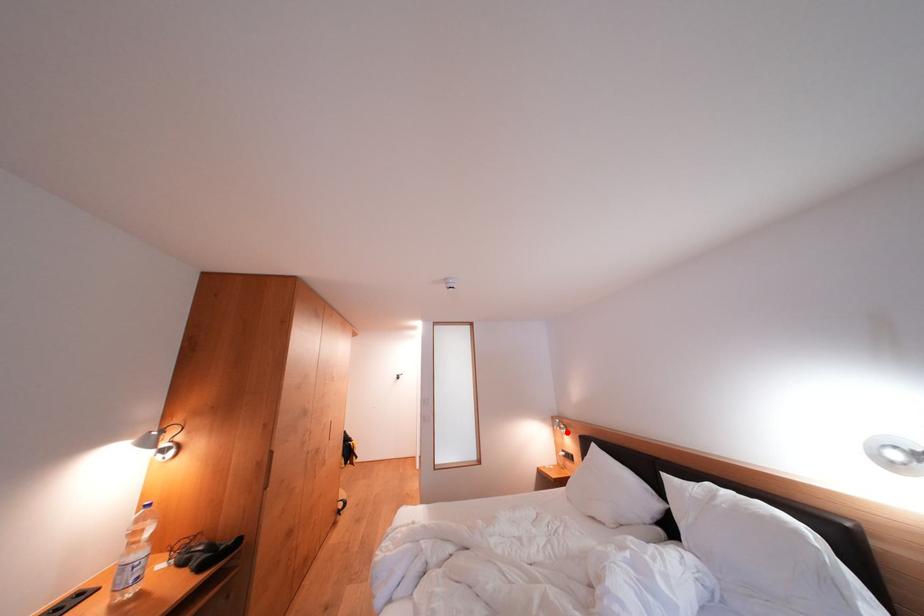
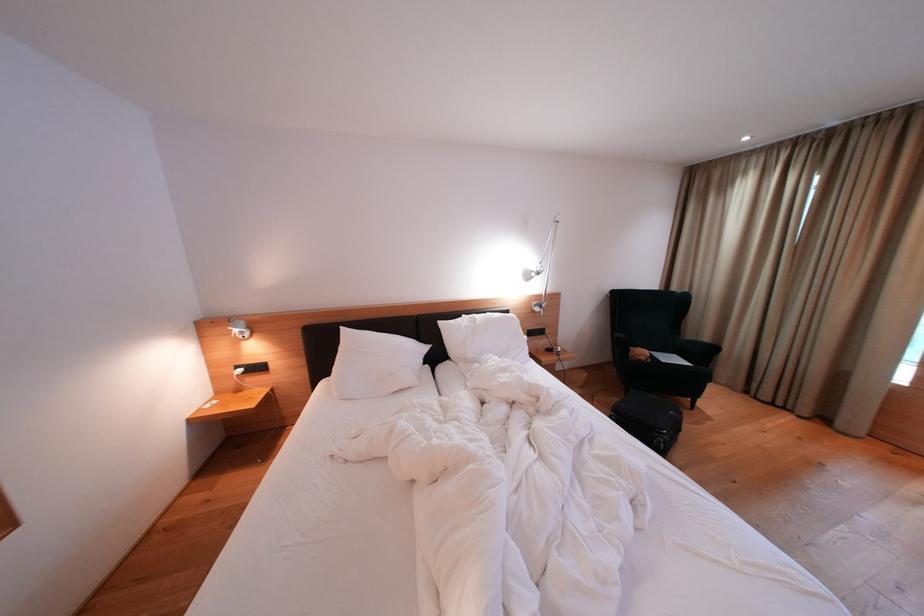
The point at the highlighted location is marked in the first image. Where is the corresponding point in the second image?

(249, 336)